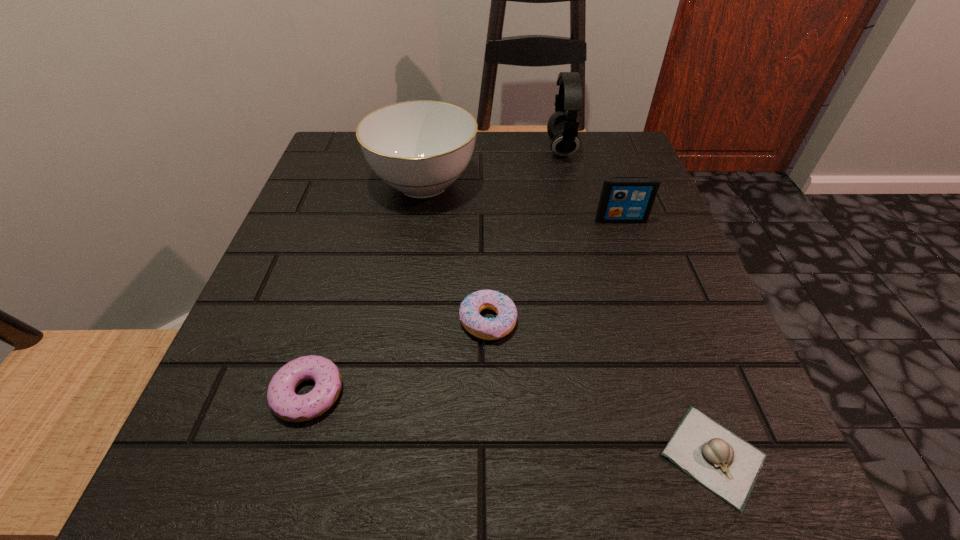
The width and height of the screenshot is (960, 540). In order to click on free spot between the fifth shortest object and the shorter doughnut in this screenshot , I will do `click(366, 288)`.

Locate an element on the screen. The width and height of the screenshot is (960, 540). free spot between the tallest object and the iPod is located at coordinates (591, 184).

Where is `object that can be found as the closest to the garlic`? The image size is (960, 540). object that can be found as the closest to the garlic is located at coordinates (487, 329).

The image size is (960, 540). Identify the location of object that is the fifth closest one to the second tallest object. (726, 464).

The height and width of the screenshot is (540, 960). I want to click on free location that satisfies the following two spatial constraints: 1. on the front screen of the garlic; 2. on the left side of the iPod, so click(704, 455).

Find the location of a particular element. This screenshot has width=960, height=540. free location that satisfies the following two spatial constraints: 1. on the ear cups of the tallest object; 2. on the left side of the garlic is located at coordinates (636, 455).